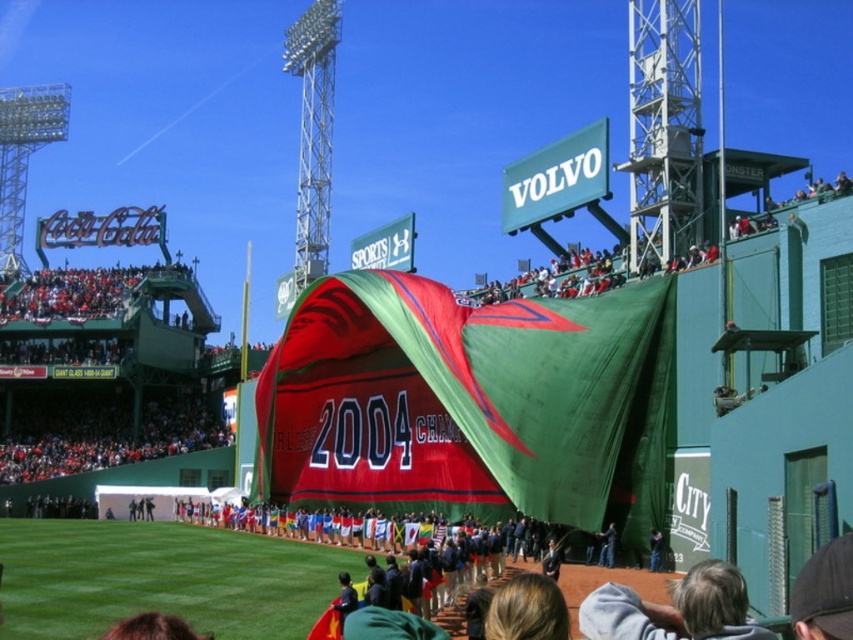
Question: Among these points, which one is farthest from the camera?

Choices:
 (A) (599, 540)
 (B) (648, 561)

Answer: (A)

Question: In this image, where is dark blue jeans at center located relative to green fabric person at lower center?

Choices:
 (A) below
 (B) above

Answer: (A)

Question: Does dark blue jeans at center appear on the left side of green fabric person at lower center?

Choices:
 (A) yes
 (B) no

Answer: (A)

Question: Which object is closer to the camera taking this photo?

Choices:
 (A) green fabric person at lower center
 (B) dark blue jeans at center

Answer: (A)

Question: Is dark blue jeans at center thinner than green fabric person at lower center?

Choices:
 (A) no
 (B) yes

Answer: (A)